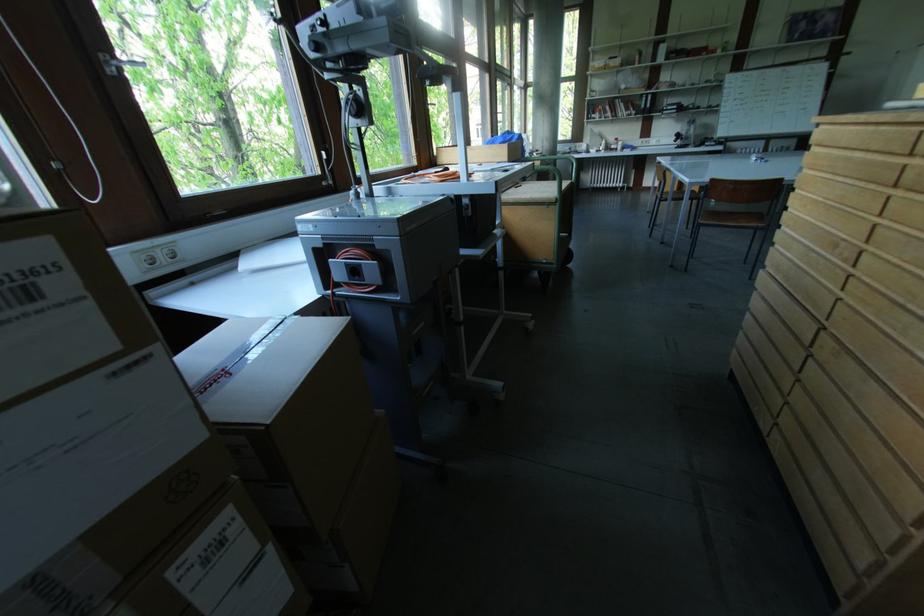
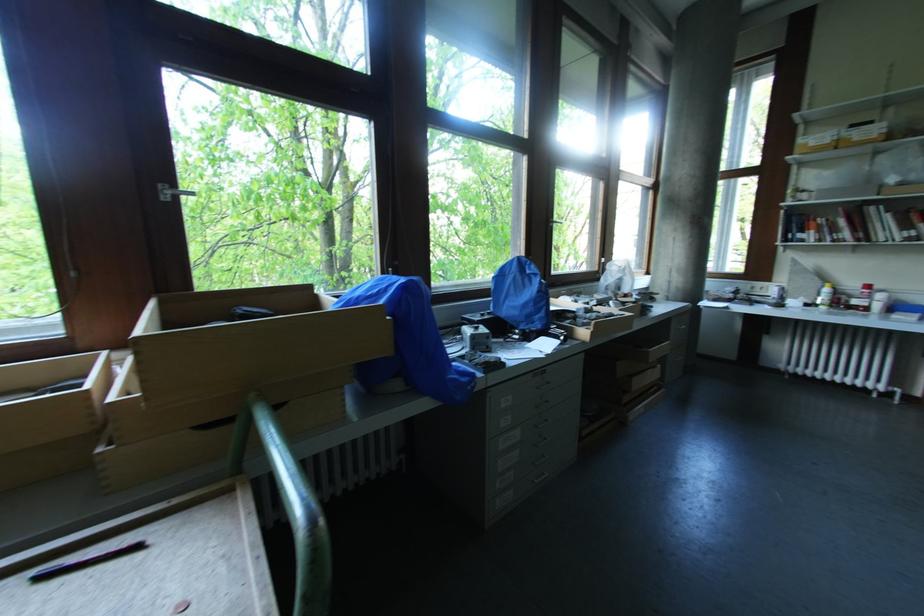
Where in the second image is the point corresponding to point (524, 188) from the first image?

(140, 549)